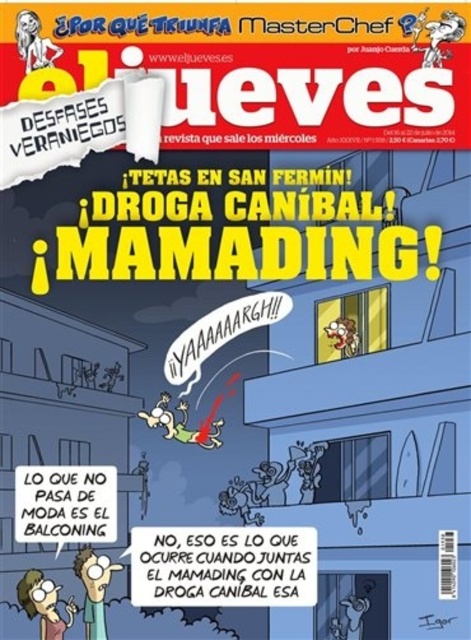
Question: Does light blue shirt at lower left have a lesser width compared to matte yellow head at upper left?

Choices:
 (A) yes
 (B) no

Answer: (B)

Question: Which of the following is the farthest from the observer?

Choices:
 (A) (71, 600)
 (B) (40, 26)

Answer: (B)

Question: Which point is farther to the camera?

Choices:
 (A) (42, 36)
 (B) (47, 618)

Answer: (A)

Question: Is light blue shirt at lower left wider than matte yellow head at upper left?

Choices:
 (A) no
 (B) yes

Answer: (B)

Question: Does matte green shirt at lower left have a larger size compared to light blue shirt at lower left?

Choices:
 (A) yes
 (B) no

Answer: (B)

Question: Among these points, which one is nearest to the camera?

Choices:
 (A) (91, 564)
 (B) (29, 593)
 (C) (39, 56)

Answer: (B)